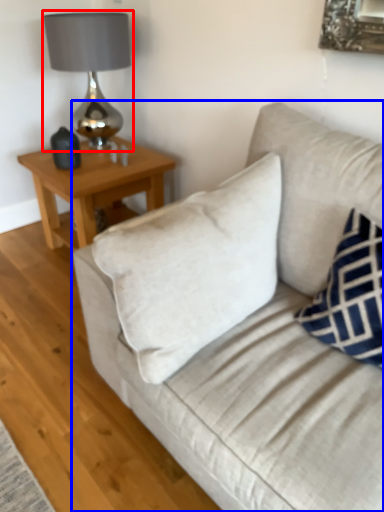
Question: Among these objects, which one is nearest to the camera, table lamp (highlighted by a red box) or studio couch (highlighted by a blue box)?

Choices:
 (A) table lamp
 (B) studio couch

Answer: (B)